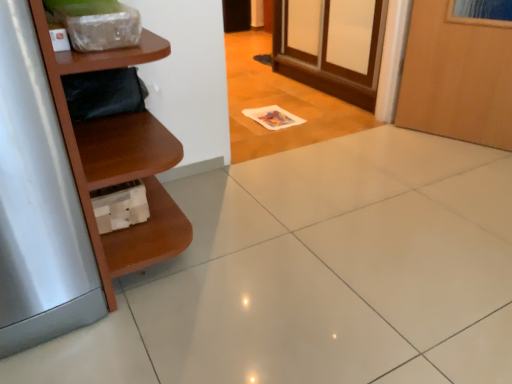
In order to click on brushed metal refrigerator at left in this screenshot , I will do `click(38, 203)`.

This screenshot has height=384, width=512. What do you see at coordinates (38, 203) in the screenshot? I see `brushed metal refrigerator at left` at bounding box center [38, 203].

Measure the distance between brushed metal refrigerator at left and camera.

25.23 inches.

Describe the element at coordinates (119, 159) in the screenshot. The width and height of the screenshot is (512, 384). I see `brown wood shelf at left` at that location.

You are a GUI agent. You are given a task and a screenshot of the screen. Output one action in this format:
    pyautogui.click(x=<x>, y=<y>)
    Task: Click on the brown wood shelf at left
    Image resolution: width=512 pixels, height=384 pixels.
    Given the screenshot: What is the action you would take?
    pyautogui.click(x=119, y=159)

What is the approximate width of brown wood shelf at left?

brown wood shelf at left is 23.51 inches wide.

At what (x,y) coordinates should I click in order to perform the action: click on brushed metal refrigerator at left. Please return your answer as a coordinate pair (x, y). This screenshot has height=384, width=512. Looking at the image, I should click on (38, 203).

Can you confirm if brushed metal refrigerator at left is positioned to the left of brown wood shelf at left?

Indeed, brushed metal refrigerator at left is positioned on the left side of brown wood shelf at left.

Considering their positions, is brushed metal refrigerator at left located in front of or behind brown wood shelf at left?

Visually, brushed metal refrigerator at left is located in front of brown wood shelf at left.

Considering the positions of points (26, 312) and (158, 228), is point (26, 312) closer to camera compared to point (158, 228)?

Yes.

From the picture: From the image's perspective, which is below, brushed metal refrigerator at left or brown wood shelf at left?

brushed metal refrigerator at left.

Looking at this image, from a real-world perspective, is brushed metal refrigerator at left positioned under brown wood shelf at left based on gravity?

Yes, from a real-world perspective, brushed metal refrigerator at left is below brown wood shelf at left.

Can you confirm if brushed metal refrigerator at left is thinner than brown wood shelf at left?

No, brushed metal refrigerator at left is not thinner than brown wood shelf at left.

Can you confirm if brushed metal refrigerator at left is taller than brown wood shelf at left?

Correct, brushed metal refrigerator at left is much taller as brown wood shelf at left.

Does brushed metal refrigerator at left have a larger size compared to brown wood shelf at left?

No.

Would you say brushed metal refrigerator at left contains brown wood shelf at left?

No, brown wood shelf at left is not surrounded by brushed metal refrigerator at left.

Is brushed metal refrigerator at left not near brown wood shelf at left?

brushed metal refrigerator at left is near brown wood shelf at left, not far away.

Could you tell me if brushed metal refrigerator at left is turned towards brown wood shelf at left?

No, brushed metal refrigerator at left is not turned towards brown wood shelf at left.

How far apart are brushed metal refrigerator at left and brown wood shelf at left?

The distance of brushed metal refrigerator at left from brown wood shelf at left is 5.61 inches.

At what (x,y) coordinates should I click in order to perform the action: click on shelf on the right of the brushed metal refrigerator at left. Please return your answer as a coordinate pair (x, y). Looking at the image, I should click on (119, 159).

Considering the relative positions of brown wood shelf at left and brushed metal refrigerator at left in the image provided, is brown wood shelf at left to the right of brushed metal refrigerator at left from the viewer's perspective?

Indeed, brown wood shelf at left is positioned on the right side of brushed metal refrigerator at left.

Considering the relative positions of brown wood shelf at left and brushed metal refrigerator at left in the image provided, is brown wood shelf at left behind brushed metal refrigerator at left?

Yes, it is behind brushed metal refrigerator at left.

Does point (88, 200) appear closer or farther from the camera than point (13, 228)?

Point (88, 200) appears to be farther away from the viewer than point (13, 228).

From the image's perspective, is brown wood shelf at left above or below brushed metal refrigerator at left?

Clearly, from the image's perspective, brown wood shelf at left is above brushed metal refrigerator at left.

From a real-world perspective, is brown wood shelf at left over brushed metal refrigerator at left?

Yes, from a real-world perspective, brown wood shelf at left is on top of brushed metal refrigerator at left.

Can you confirm if brown wood shelf at left is thinner than brushed metal refrigerator at left?

Indeed, brown wood shelf at left has a lesser width compared to brushed metal refrigerator at left.

In terms of height, does brown wood shelf at left look taller or shorter compared to brushed metal refrigerator at left?

Considering their sizes, brown wood shelf at left has less height than brushed metal refrigerator at left.

Looking at this image, does brown wood shelf at left have a larger size compared to brushed metal refrigerator at left?

Yes, brown wood shelf at left is bigger than brushed metal refrigerator at left.

Is brown wood shelf at left positioned beyond the bounds of brushed metal refrigerator at left?

Absolutely, brown wood shelf at left is external to brushed metal refrigerator at left.

Is brown wood shelf at left in contact with brushed metal refrigerator at left?

No, brown wood shelf at left is not with brushed metal refrigerator at left.

Is brushed metal refrigerator at left at the back of brown wood shelf at left?

brown wood shelf at left does not have its back to brushed metal refrigerator at left.

Where is `shelf on the right of brushed metal refrigerator at left`? shelf on the right of brushed metal refrigerator at left is located at coordinates (119, 159).

Locate an element on the screen. This screenshot has width=512, height=384. silver to the left of brown wood shelf at left is located at coordinates (38, 203).

In the image, there is a brown wood shelf at left. At what (x,y) coordinates should I click in order to perform the action: click on silver below it (from a real-world perspective). Please return your answer as a coordinate pair (x, y). This screenshot has width=512, height=384. Looking at the image, I should click on (38, 203).